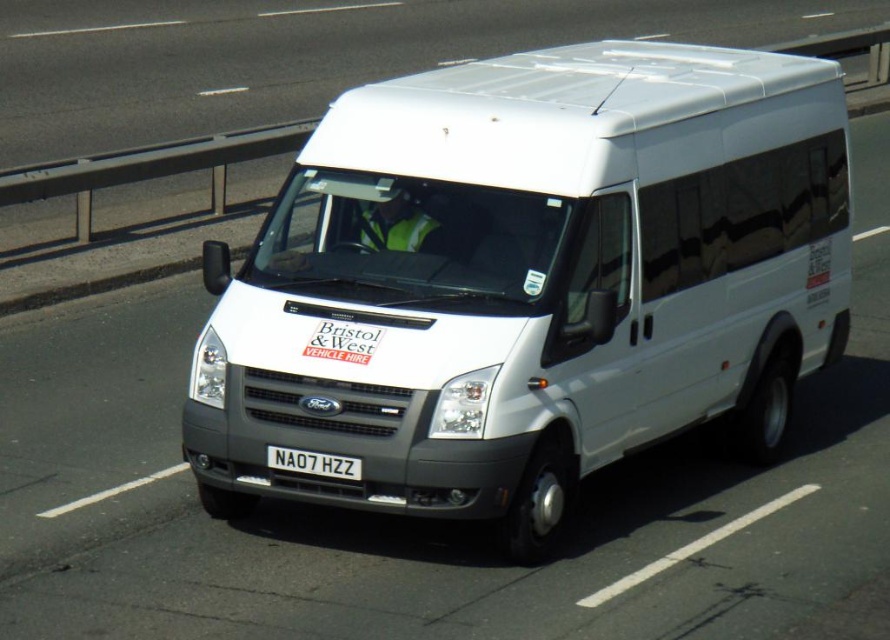
Question: Is white matte van at center further to the viewer compared to white plastic license plate at center?

Choices:
 (A) yes
 (B) no

Answer: (B)

Question: Which point is closer to the camera taking this photo?

Choices:
 (A) (365, 173)
 (B) (313, 458)

Answer: (B)

Question: Which point is closer to the camera taking this photo?

Choices:
 (A) (305, 406)
 (B) (344, 468)

Answer: (B)

Question: Does white matte van at center have a greater width compared to white plastic license plate at center?

Choices:
 (A) no
 (B) yes

Answer: (B)

Question: Can you confirm if white matte van at center is bigger than white plastic license plate at center?

Choices:
 (A) no
 (B) yes

Answer: (B)